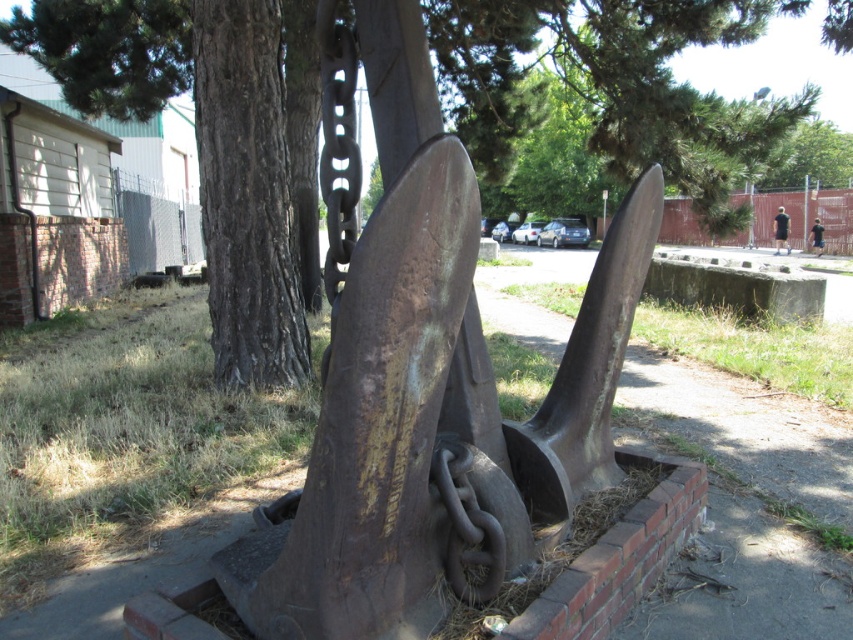
From the picture: You are a gardener planning to plant a new flower bed near the rusty metal anchor at center and the green leafy tree at upper center. Considering their positions, where should you place the flower bed so it is not directly under the tree?

The rusty metal anchor at center is located below the green leafy tree at upper center, so placing the flower bed near the rusty metal anchor at center would ensure it is not directly under the tree.

You are standing in a park and see the rusty metal anchor at center and the green leafy tree at upper center. Which object is positioned to the right side of the other?

The green leafy tree at upper center is positioned to the right of the rusty metal anchor at center.

Looking at this image, you are a painter standing at the base of the green leafy tree at upper center, looking towards the rusty metal anchor at center. Which object is closer to the ground?

The rusty metal anchor at center is closer to the ground than the green leafy tree at upper center because it is shorter.